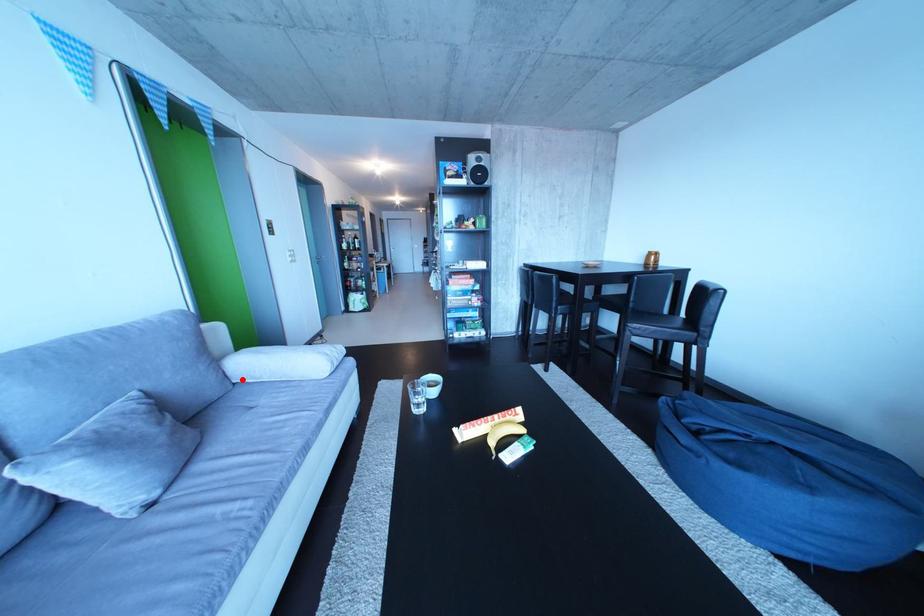
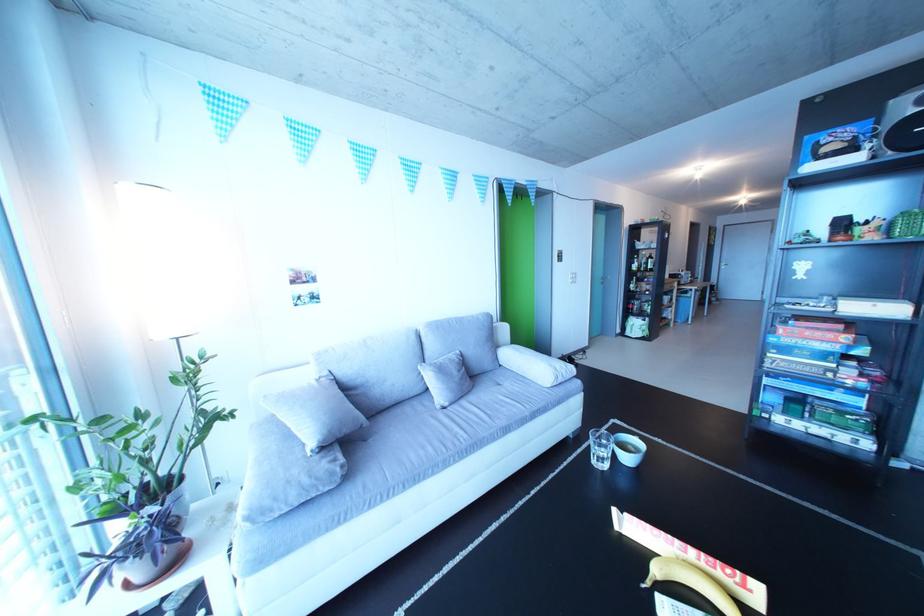
In the second image, find the point that corresponds to the highlighted location in the first image.

(513, 363)